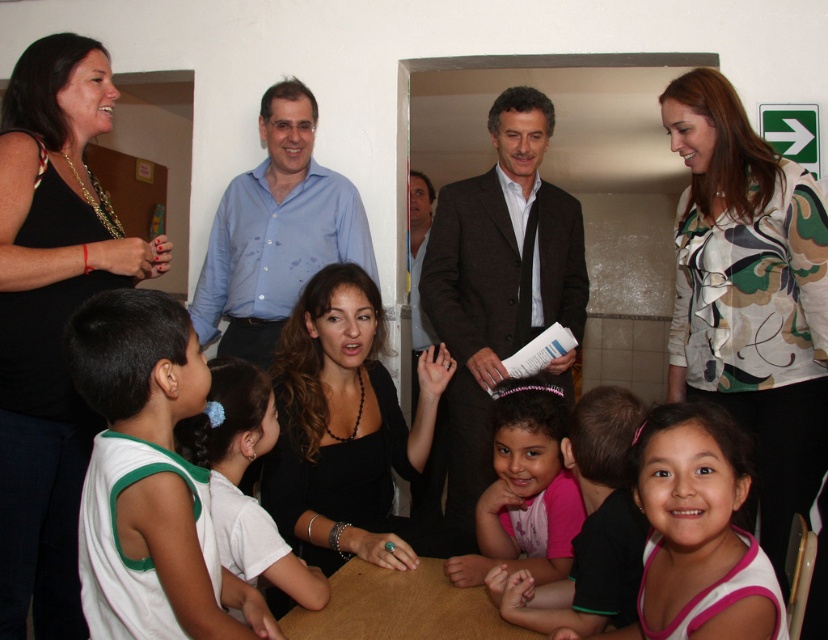
Question: Which point appears closest to the camera in this image?

Choices:
 (A) (196, 422)
 (B) (109, 609)
 (C) (460, 385)

Answer: (B)

Question: Can you confirm if floral-patterned blouse at upper right is thinner than white cotton shirt at lower left?

Choices:
 (A) no
 (B) yes

Answer: (A)

Question: Is black fabric at upper left to the left of blue shirt at center from the viewer's perspective?

Choices:
 (A) no
 (B) yes

Answer: (B)

Question: Can you confirm if floral-patterned blouse at upper right is positioned above pink fabric shirt at lower center?

Choices:
 (A) yes
 (B) no

Answer: (A)

Question: Which of the following is the closest to the observer?

Choices:
 (A) pink jersey at lower right
 (B) dark brown suit at center
 (C) brown wooden table at center
 (D) floral-patterned blouse at upper right

Answer: (A)

Question: Which point is farther from the camera taking this photo?

Choices:
 (A) (374, 621)
 (B) (624, 520)

Answer: (A)